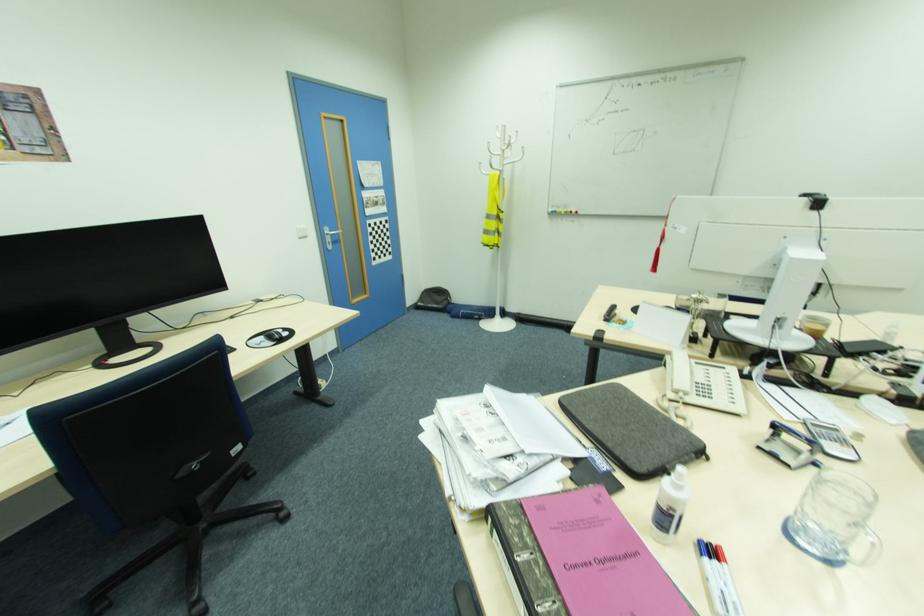
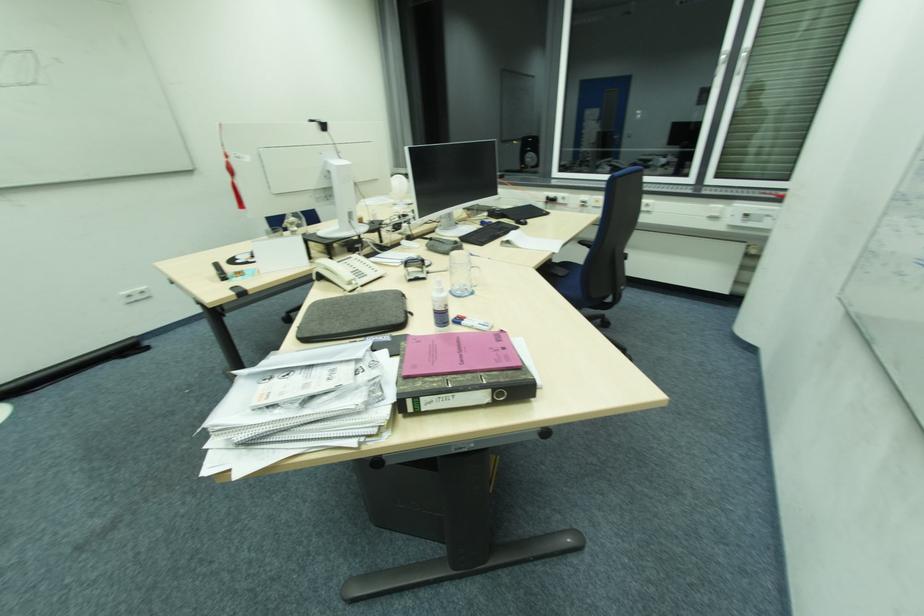
The point at (699, 363) is marked in the first image. Where is the corresponding point in the second image?

(342, 262)